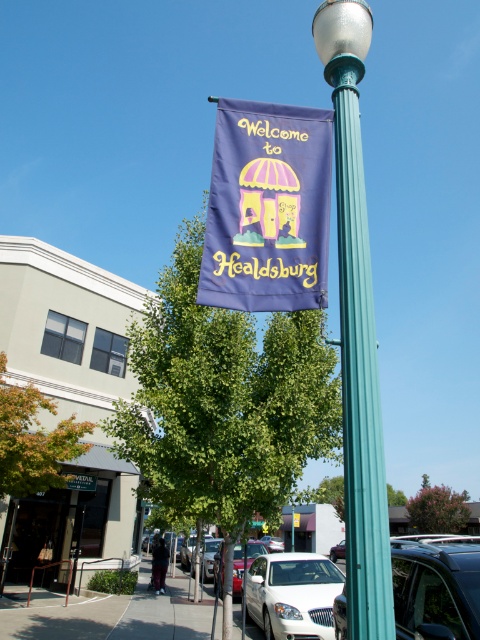
You are a street artist planning to paint a mural on the purple fabric banner at center and the green leafy tree at lower left. Which object requires a wider brush stroke to cover its entire width?

The green leafy tree at lower left requires a wider brush stroke because the purple fabric banner at center is narrower than the green leafy tree at lower left.

You are standing at point (224, 401) in the urban street scene. What object is located exactly at your current position?

The green leafy tree at center is located exactly at point (224, 401).